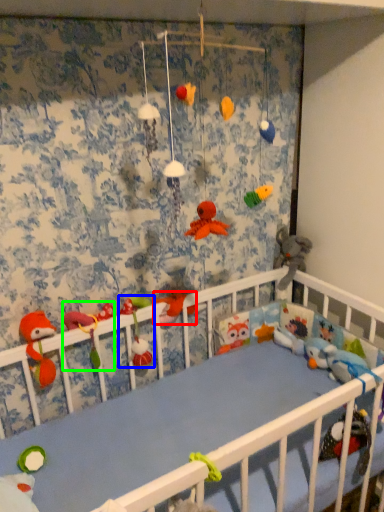
Question: Estimate the real-world distances between objects in this image. Which object is farther from toy (highlighted by a red box), toy (highlighted by a blue box) or toy (highlighted by a green box)?

Choices:
 (A) toy
 (B) toy

Answer: (B)